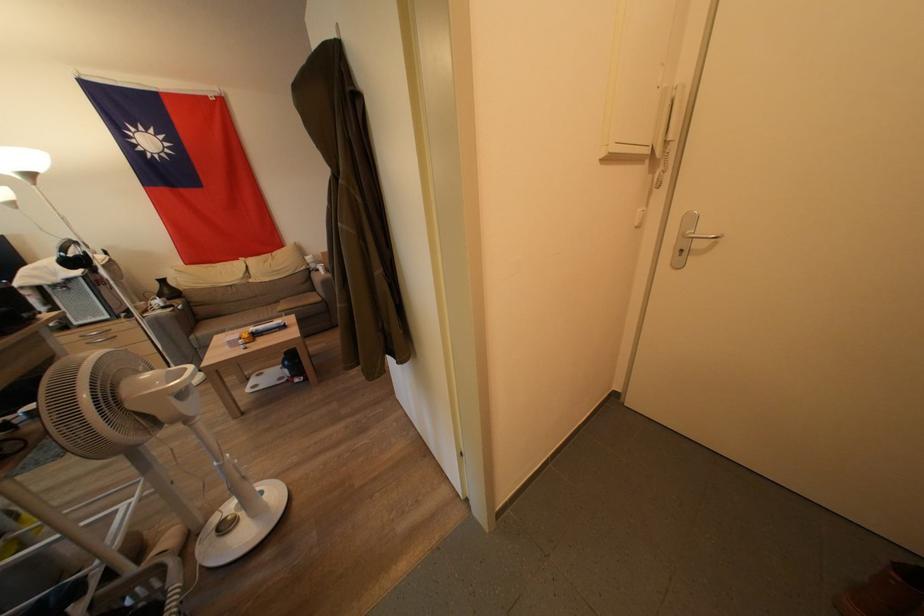
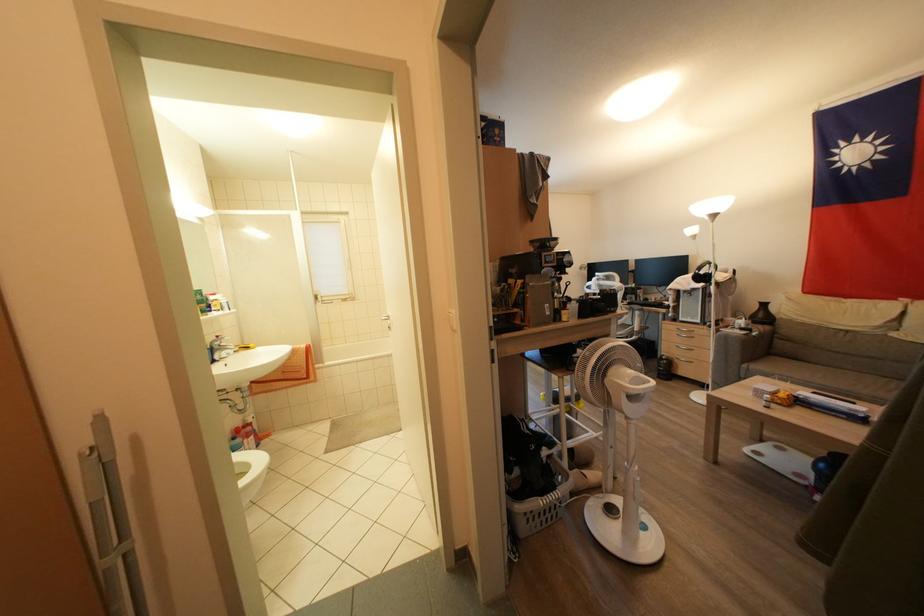
The point at (81,328) is marked in the first image. Where is the corresponding point in the second image?

(686, 323)